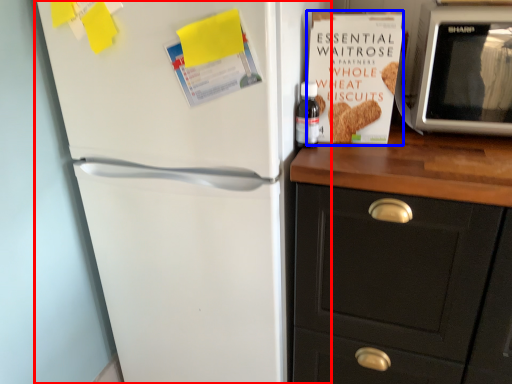
Question: Which object is closer to the camera taking this photo, refrigerator (highlighted by a red box) or paperback book (highlighted by a blue box)?

Choices:
 (A) refrigerator
 (B) paperback book

Answer: (A)